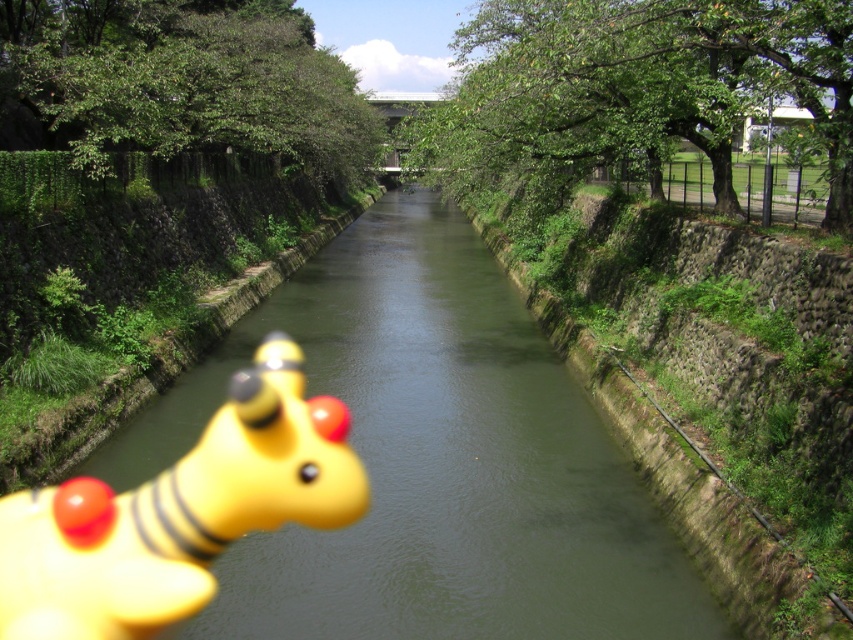
You are standing at the edge of the canal and see two points marked in the image. Which point is closer to you, point [601,509] or point [61,573]?

Point [61,573] is closer to you because it is less far from the camera than point [601,509].

You are a child who wants to play with the yellow rubber toy at lower left and the green stone creek at center. Which object is closer to your current position if you are standing on the left bank of the canal?

The yellow rubber toy at lower left is closer to your current position because it is positioned on the left side of the green stone creek at center, meaning it is nearer to the left bank where you are standing.

From the picture: You are standing on the bank of the canal and want to cross to the opposite side. The green stone creek at center is in your path. Can you step over it?

The green stone creek at center is 9.03 meters away from you, so you can step over it easily.